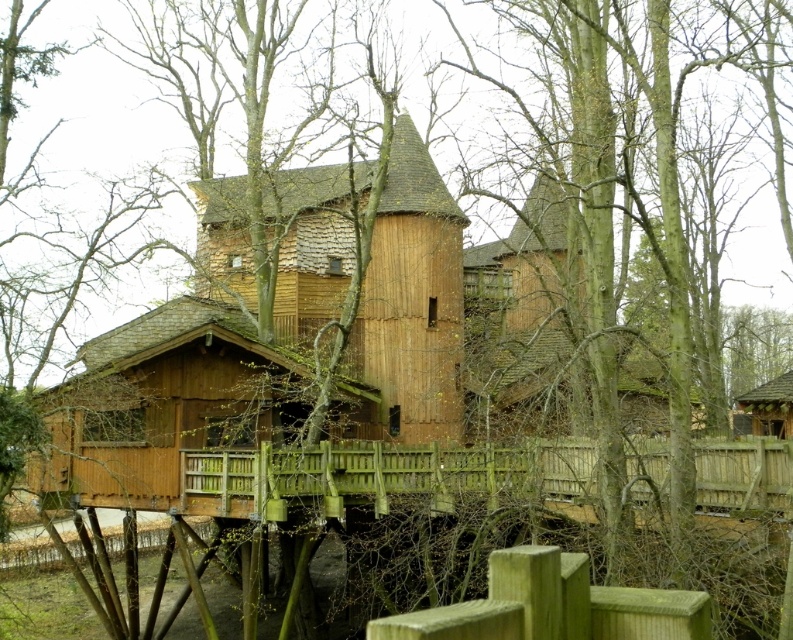
Does wooden cabin at center appear under green rough wooden post at lower center?

Yes, wooden cabin at center is below green rough wooden post at lower center.

Measure the distance between wooden cabin at center and camera.

They are 75.90 feet apart.

You are a GUI agent. You are given a task and a screenshot of the screen. Output one action in this format:
    pyautogui.click(x=<x>, y=<y>)
    Task: Click on the wooden cabin at center
    Image resolution: width=793 pixels, height=640 pixels.
    Given the screenshot: What is the action you would take?
    pyautogui.click(x=163, y=406)

Where is `wooden cabin at center`? The height and width of the screenshot is (640, 793). wooden cabin at center is located at coordinates (163, 406).

Which is above, wooden hut at center or wooden hut at right?

Positioned higher is wooden hut at center.

Which is in front, point (449, 243) or point (780, 397)?

Point (449, 243) is more forward.

I want to click on wooden hut at center, so click(x=412, y=298).

Find the location of a particular element. The image size is (793, 640). wooden hut at center is located at coordinates (412, 298).

Describe the element at coordinates (412, 298) in the screenshot. I see `wooden hut at center` at that location.

Locate an element on the screen. This screenshot has height=640, width=793. wooden hut at center is located at coordinates (412, 298).